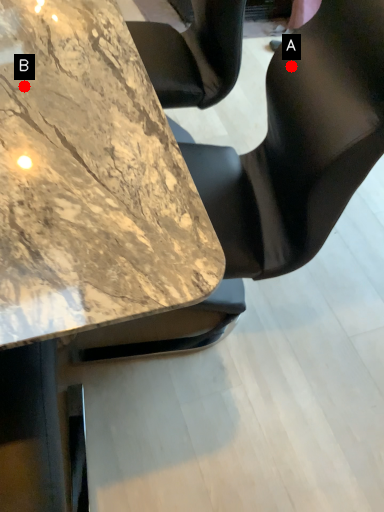
Question: Two points are circled on the image, labeled by A and B beside each circle. Which point is closer to the camera?

Choices:
 (A) A is closer
 (B) B is closer

Answer: (B)